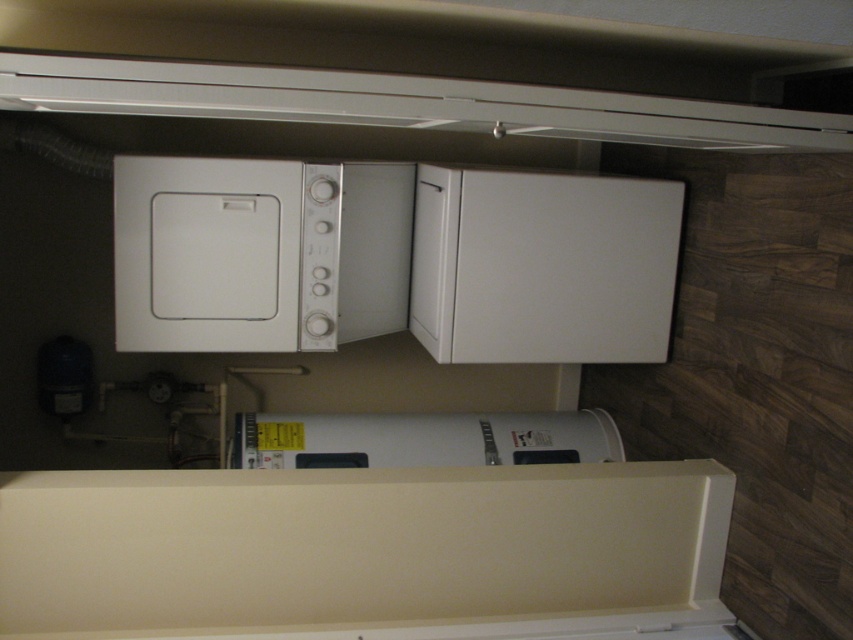
You are a technician checking the layout of the laundry area. You need to install a new sensor on the smaller of the two white matte appliances. Which appliance should you choose between the white matte exhaust hood at upper center and the white matte water heater at center?

The white matte water heater at center is smaller than the white matte exhaust hood at upper center, so you should install the sensor on the white matte water heater at center.

You are trying to install a new white matte microwave at upper left and a white matte exhaust hood at upper center in the kitchen. The existing microwave is smaller. Can the new microwave fit in the current space if the exhaust hood is already installed?

The white matte microwave at upper left is larger than the white matte exhaust hood at upper center. Since the existing microwave is smaller, the new microwave may not fit in the current space if the exhaust hood is already installed due to its larger size.

You are standing in the laundry area and need to reach both points marked in the scene. Which point, point (126, 163) or point (573, 428), will you reach first if you move directly towards them?

You will reach point (126, 163) first because it is closer to you than point (573, 428).